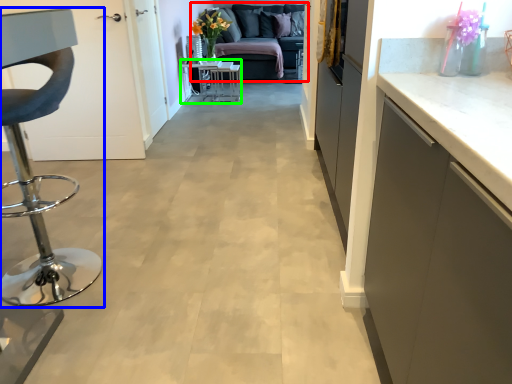
Question: Based on their relative distances, which object is nearer to studio couch (highlighted by a red box)? Choose from furniture (highlighted by a blue box) and table (highlighted by a green box).

Choices:
 (A) furniture
 (B) table

Answer: (B)